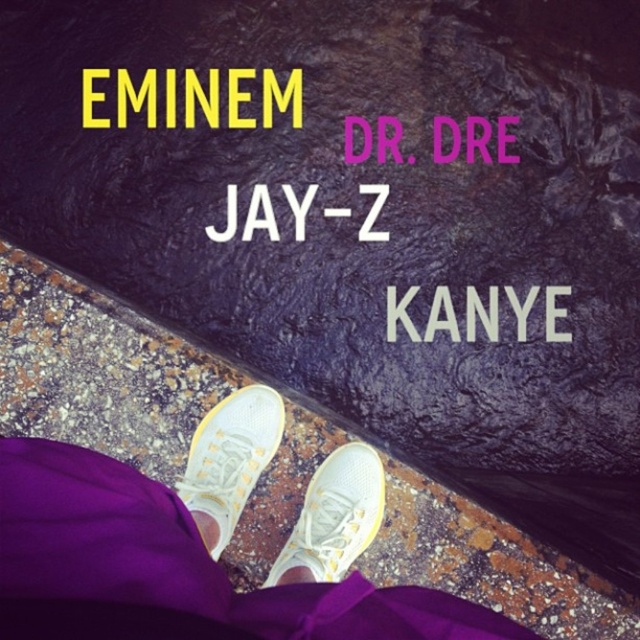
Which of these two, white mesh shoe at center or white matte text at center, stands taller?

white mesh shoe at center is taller.

Does point (314, 560) lie behind point (253, 204)?

No.

Identify the location of white mesh shoe at center. The height and width of the screenshot is (640, 640). (333, 516).

Is white canvas sneakers at center positioned at the back of white matte text at center?

No, white canvas sneakers at center is in front of white matte text at center.

Consider the image. Does white canvas sneakers at center appear on the left side of white matte text at center?

Indeed, white canvas sneakers at center is positioned on the left side of white matte text at center.

Which is behind, point (198, 496) or point (371, 234)?

Positioned behind is point (371, 234).

Where is `white canvas sneakers at center`? Image resolution: width=640 pixels, height=640 pixels. white canvas sneakers at center is located at coordinates (228, 460).

Is white mesh sneakers at center wider than white canvas sneakers at center?

Indeed, white mesh sneakers at center has a greater width compared to white canvas sneakers at center.

Does white mesh sneakers at center have a larger size compared to white canvas sneakers at center?

Yes.

Image resolution: width=640 pixels, height=640 pixels. Find the location of `white mesh sneakers at center`. white mesh sneakers at center is located at coordinates (202, 545).

The image size is (640, 640). I want to click on white mesh sneakers at center, so click(202, 545).